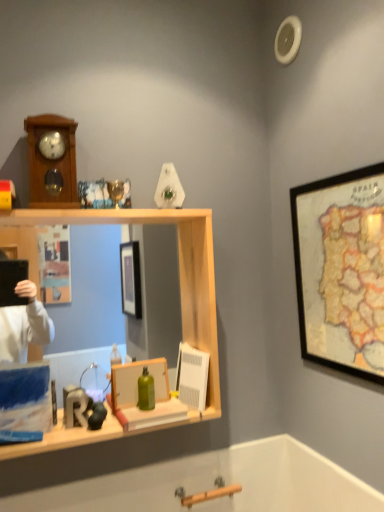
Question: In the image, is blue matte box at left on the left side or the right side of matte wooden picture frame at center, placed as the 1th picture frame when sorted from bottom to top?

Choices:
 (A) right
 (B) left

Answer: (B)

Question: Considering the positions of point (9, 412) and point (165, 378), is point (9, 412) closer or farther from the camera than point (165, 378)?

Choices:
 (A) farther
 (B) closer

Answer: (B)

Question: Which object is positioned farthest from the wooden clock at upper left?

Choices:
 (A) matte wooden picture frame at center, placed as the 1th picture frame when sorted from bottom to top
 (B) wooden shelf at center
 (C) blue matte box at left
 (D) green matte bottle at center
 (E) wooden framed map at upper right, the second picture frame in the left-to-right sequence

Answer: (E)

Question: Which of these objects is positioned closest to the blue matte box at left?

Choices:
 (A) wooden clock at upper left
 (B) matte wooden picture frame at center, placed as the 1th picture frame when sorted from bottom to top
 (C) green matte bottle at center
 (D) wooden framed map at upper right, positioned as the second picture frame in bottom-to-top order
 (E) wooden shelf at center

Answer: (B)